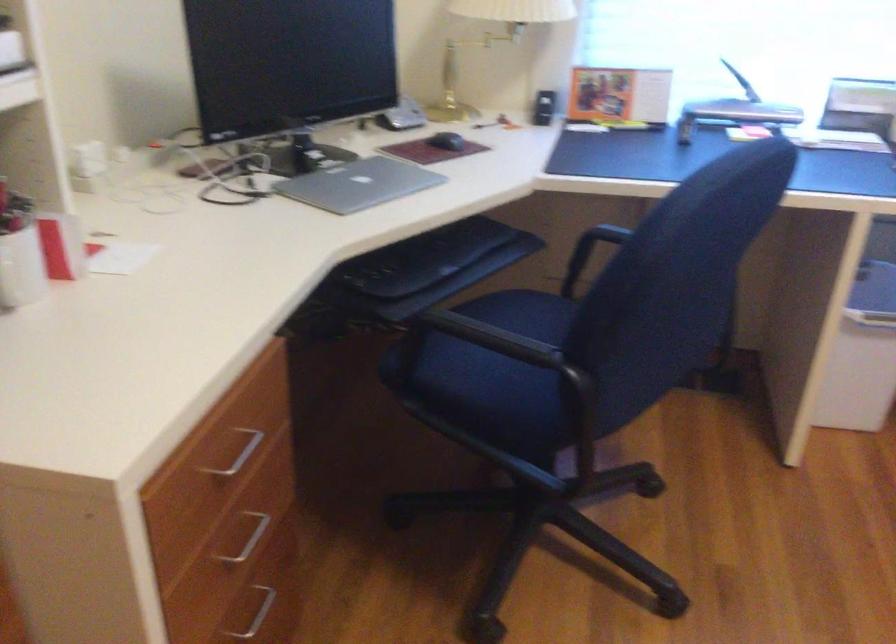
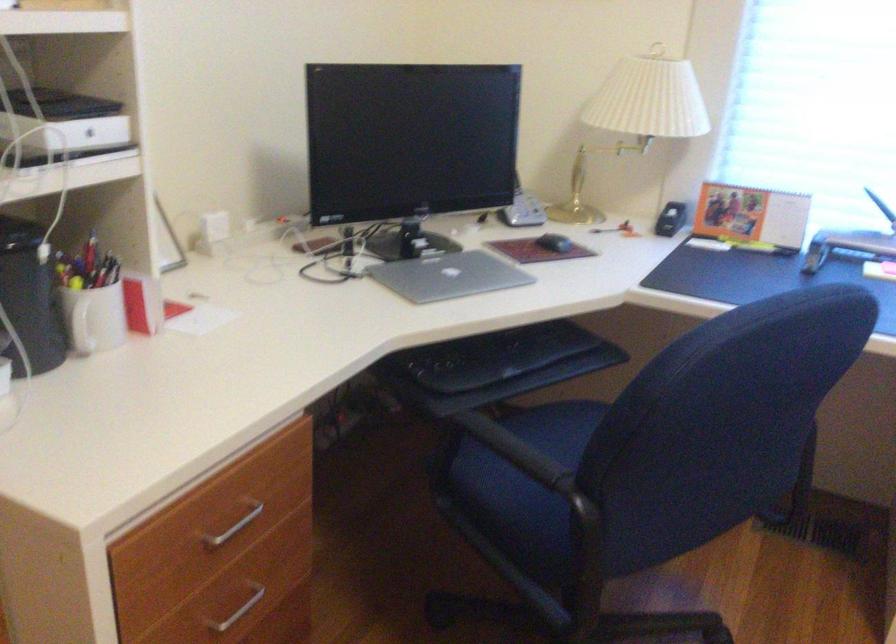
Find the pixel in the second image that matches point 248,550 in the first image.

(238, 611)